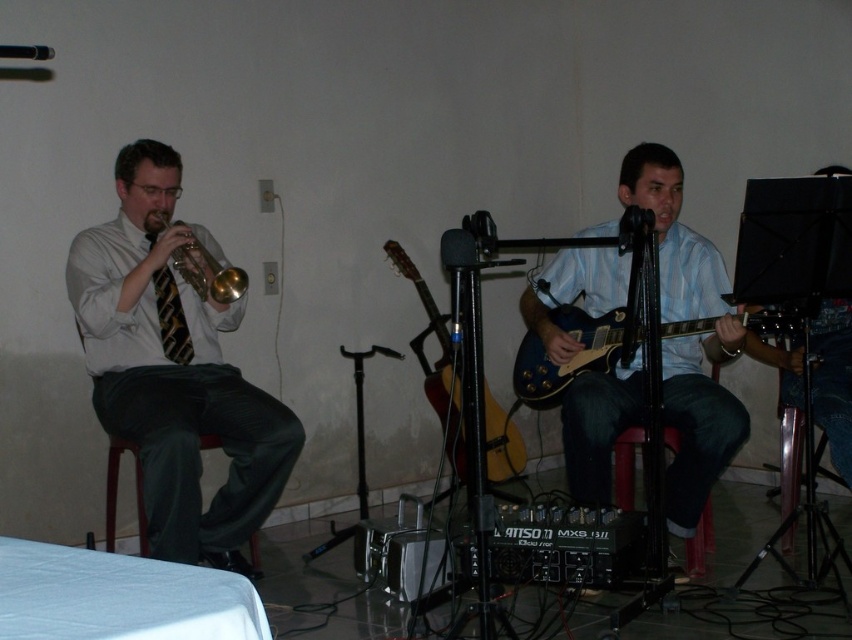
Can you confirm if glossy wood guitar at center is positioned below gold shiny trumpet at left?

Yes.

Is point (456, 420) behind point (222, 301)?

Yes, it is behind point (222, 301).

Between point (453, 404) and point (183, 273), which one is positioned behind?

The point (453, 404) is behind.

Identify the location of glossy wood guitar at center. (436, 362).

Is shiny gold trumpet at left smaller than glossy wood guitar at center?

Yes.

Does shiny gold trumpet at left appear under glossy wood guitar at center?

No, shiny gold trumpet at left is not below glossy wood guitar at center.

Describe the element at coordinates (174, 369) in the screenshot. I see `shiny gold trumpet at left` at that location.

The width and height of the screenshot is (852, 640). In order to click on shiny gold trumpet at left in this screenshot , I will do `click(174, 369)`.

Between matte blue guitar at center and blue glossy electric guitar at center, which one appears on the left side from the viewer's perspective?

matte blue guitar at center is more to the left.

Does matte blue guitar at center have a greater height compared to blue glossy electric guitar at center?

Indeed, matte blue guitar at center has a greater height compared to blue glossy electric guitar at center.

Is point (653, 157) in front of point (623, 324)?

That is False.

You are a GUI agent. You are given a task and a screenshot of the screen. Output one action in this format:
    pyautogui.click(x=<x>, y=<y>)
    Task: Click on the matte blue guitar at center
    
    Given the screenshot: What is the action you would take?
    pyautogui.click(x=688, y=337)